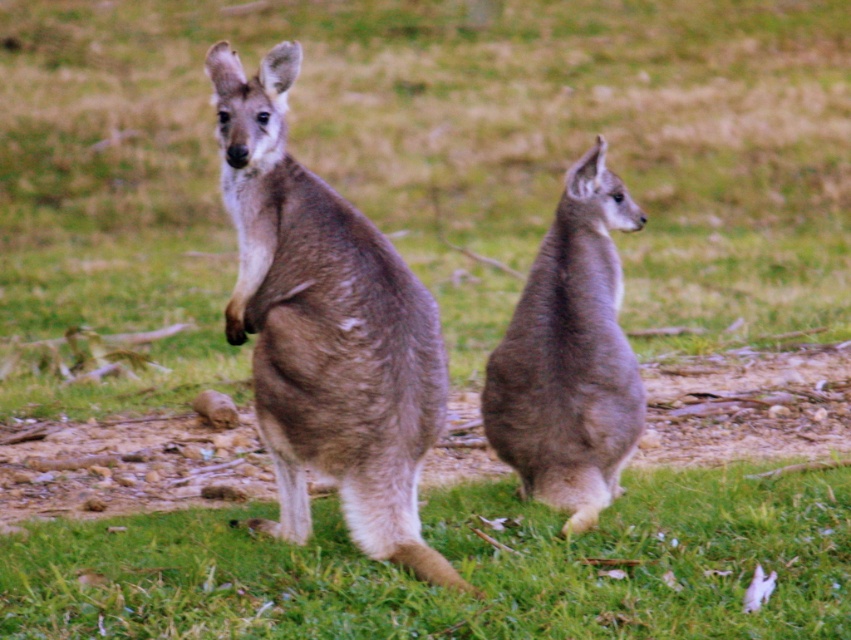
Question: Can you confirm if green soft grass at lower center is bigger than gray fur kangaroo at center?

Choices:
 (A) yes
 (B) no

Answer: (A)

Question: Is the position of green soft grass at lower center less distant than that of brown fur kangaroo at center?

Choices:
 (A) no
 (B) yes

Answer: (B)

Question: Which object appears closest to the camera in this image?

Choices:
 (A) green soft grass at lower center
 (B) brown fur kangaroo at center

Answer: (A)

Question: Estimate the real-world distances between objects in this image. Which object is closer to the green soft grass at lower center?

Choices:
 (A) brown fur kangaroo at center
 (B) gray fur kangaroo at center

Answer: (B)

Question: Does brown fur kangaroo at center lie in front of gray fur kangaroo at center?

Choices:
 (A) yes
 (B) no

Answer: (A)

Question: Based on their relative distances, which object is farther from the brown fur kangaroo at center?

Choices:
 (A) green soft grass at lower center
 (B) gray fur kangaroo at center

Answer: (B)